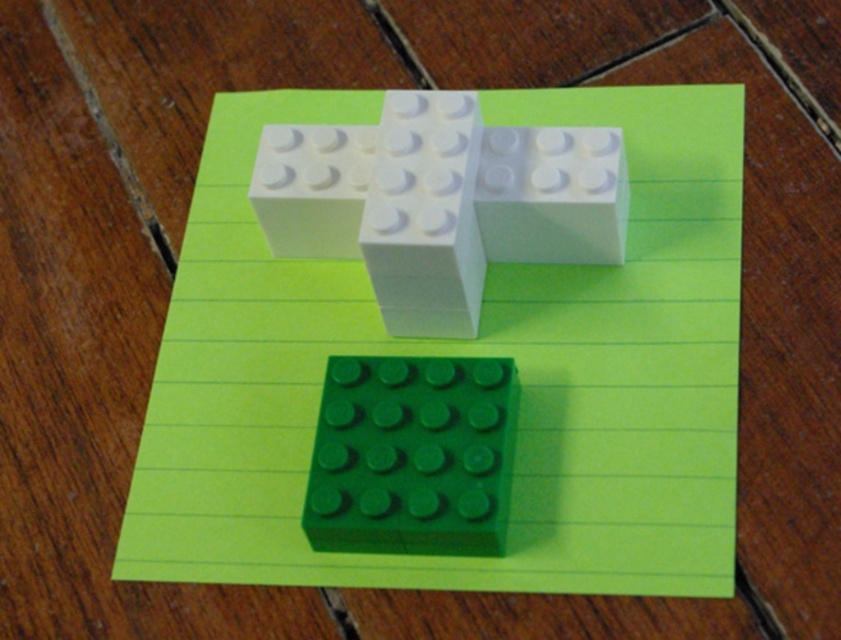
Question: Is green matte block at center to the right of white matte block at center from the viewer's perspective?

Choices:
 (A) no
 (B) yes

Answer: (A)

Question: Which is farther from the white matte block at center?

Choices:
 (A) white matte plastic blocks at upper center
 (B) white plastic brick at upper center
 (C) green matte block at center

Answer: (B)

Question: Among these objects, which one is farthest from the camera?

Choices:
 (A) green matte block at center
 (B) white matte block at center

Answer: (B)

Question: Which point appears farthest from the camera in this image?

Choices:
 (A) (321, 241)
 (B) (384, 124)
 (C) (464, 52)

Answer: (C)

Question: Does white matte plastic blocks at upper center come behind white plastic brick at upper center?

Choices:
 (A) yes
 (B) no

Answer: (B)

Question: Is green matte block at center below white matte block at center?

Choices:
 (A) no
 (B) yes

Answer: (B)